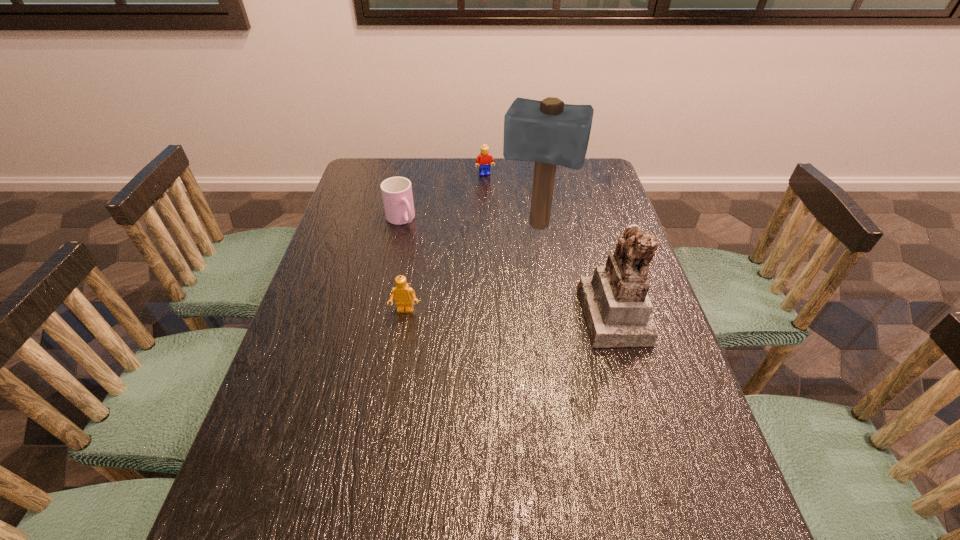
I want to click on free region at the far edge of the desktop, so click(x=454, y=159).

Image resolution: width=960 pixels, height=540 pixels. What are the coordinates of `vacant region at the left edge of the desktop` in the screenshot? It's located at (310, 369).

I want to click on vacant space at the right edge, so click(618, 218).

Locate an element on the screen. This screenshot has width=960, height=540. vacant space at the far left corner of the desktop is located at coordinates (362, 167).

This screenshot has height=540, width=960. I want to click on vacant space at the near left corner of the desktop, so click(x=278, y=486).

Identify the location of empty space between the left Lego and the cup. (403, 265).

You are a GUI agent. You are given a task and a screenshot of the screen. Output one action in this format:
    pyautogui.click(x=<x>, y=<y>)
    Task: Click on the free space between the cup and the left Lego
    The height and width of the screenshot is (540, 960).
    Given the screenshot: What is the action you would take?
    pyautogui.click(x=403, y=265)

I want to click on vacant area that lies between the fourth shortest object and the farther Lego, so click(549, 244).

Locate an element on the screen. The width and height of the screenshot is (960, 540). empty space between the cup and the fourth shortest object is located at coordinates 507,267.

The image size is (960, 540). I want to click on free space between the mallet and the nearer Lego, so click(471, 268).